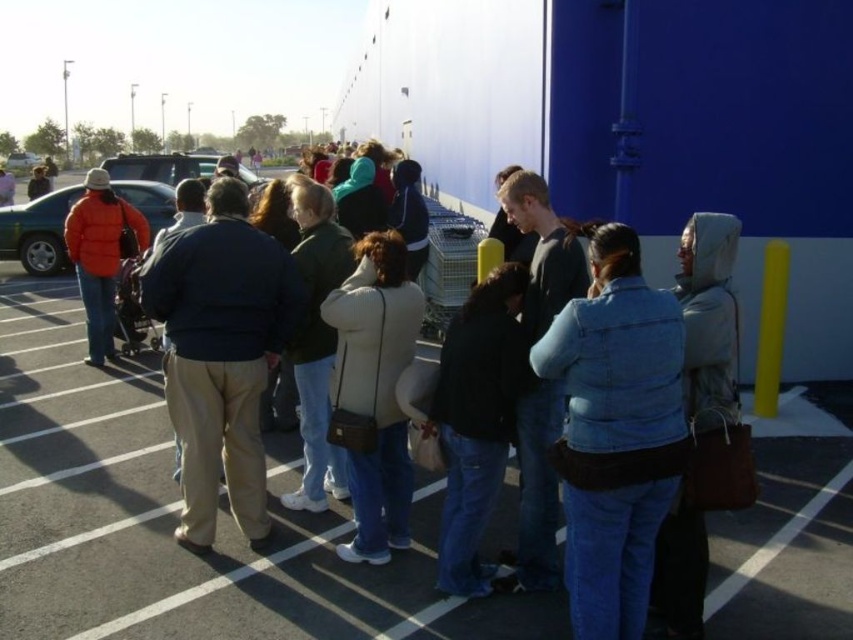
Does point (136, 621) come closer to viewer compared to point (469, 378)?

Yes.

Is point (9, 540) positioned after point (474, 337)?

Yes, it is behind point (474, 337).

At what (x,y) coordinates should I click in order to perform the action: click on blue denim jeans at center. Please return your answer as a coordinate pair (x, y). The height and width of the screenshot is (640, 853). Looking at the image, I should click on (189, 556).

Between light beige jacket at center and orange matte jacket at left, which one has less height?

orange matte jacket at left is shorter.

Does light beige jacket at center appear under orange matte jacket at left?

Correct, light beige jacket at center is located below orange matte jacket at left.

Who is more distant from viewer, (364, 337) or (45, 262)?

Point (45, 262)

The height and width of the screenshot is (640, 853). What are the coordinates of `light beige jacket at center` in the screenshot? It's located at (375, 388).

Does dark blue jeans at center appear under orange puffy jacket at left?

Indeed, dark blue jeans at center is positioned under orange puffy jacket at left.

Is dark blue jeans at center closer to camera compared to orange puffy jacket at left?

Yes, dark blue jeans at center is in front of orange puffy jacket at left.

Image resolution: width=853 pixels, height=640 pixels. I want to click on dark blue jeans at center, so click(x=476, y=420).